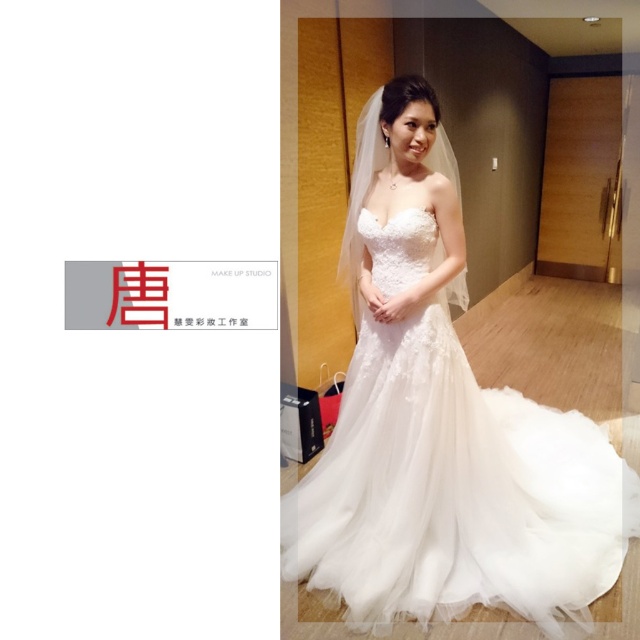
You are a photographer setting up for a wedding photoshoot. You need to position a light source to highlight the white lace dress at center. Based on the scene description, where should you place the light source relative to the dress to ensure optimal lighting?

The white lace dress at center is located at point (440, 422). To ensure optimal lighting, the light source should be positioned in a way that it illuminates the dress from the front or slightly to the side, avoiding harsh shadows. Since the scene has warm and soft lighting already, placing the light source at an angle facing the dress from the direction opposite the existing light might create a balanced and flattering effect.

You are a photographer setting up for a wedding photo shoot. You need to ensure that the white lace veil at upper center does not block the view of the white lace dress at center. Based on the scene description, is the current positioning of these items likely to cause an obstruction?

The white lace veil at upper center is positioned above the white lace dress at center, so it may partially obstruct the view of the dress depending on the angle and lighting. Adjusting the veil slightly or repositioning the subject could help ensure the dress is fully visible.